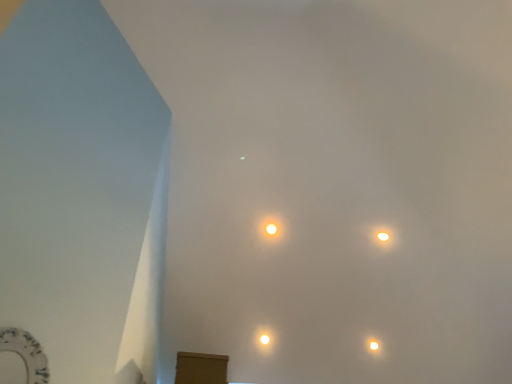
How much space does white glossy lamp at center, positioned as the third lamp in right-to-left order, occupy horizontally?

1.65 inches.

This screenshot has width=512, height=384. Find the location of `white glossy lamp at center, positioned as the third lamp in right-to-left order`. white glossy lamp at center, positioned as the third lamp in right-to-left order is located at coordinates (264, 339).

Is white glossy lamp at upper right, which appears as the second lamp when viewed from the top, turned away from white glossy lamp at center, positioned as the third lamp in right-to-left order?

No, white glossy lamp at upper right, which appears as the second lamp when viewed from the top,'s orientation is not away from white glossy lamp at center, positioned as the third lamp in right-to-left order.

Considering the sizes of objects white glossy lamp at upper right, which appears as the second lamp when viewed from the top, and white glossy lamp at center, which is counted as the 1th lamp, starting from the left, in the image provided, who is shorter, white glossy lamp at upper right, which appears as the second lamp when viewed from the top, or white glossy lamp at center, which is counted as the 1th lamp, starting from the left,?

With less height is white glossy lamp at center, which is counted as the 1th lamp, starting from the left.

Considering the relative sizes of white glossy lamp at upper right, which is counted as the 3th lamp, starting from the left, and white glossy lamp at center, positioned as the third lamp in right-to-left order, in the image provided, is white glossy lamp at upper right, which is counted as the 3th lamp, starting from the left, wider than white glossy lamp at center, positioned as the third lamp in right-to-left order,?

No.

Between white glossy lamp at upper right, the second lamp positioned from the bottom, and white glossy lamp at center, positioned as the third lamp in right-to-left order, which one has smaller size?

white glossy lamp at center, positioned as the third lamp in right-to-left order, is smaller.

Which point is more distant from viewer, (273, 227) or (384, 235)?

Point (384, 235)

Is matte yellow light at center, which is the 3th lamp from bottom to top, shorter than white glossy lamp at upper right, which is counted as the 3th lamp, starting from the left?

Yes, matte yellow light at center, which is the 3th lamp from bottom to top, is shorter than white glossy lamp at upper right, which is counted as the 3th lamp, starting from the left.

Does matte yellow light at center, which ranks as the 2th lamp in left-to-right order, have a greater width compared to white glossy lamp at upper right, the second lamp positioned from the bottom?

Answer: Yes.

Considering the positions of point (269, 338) and point (380, 237), is point (269, 338) closer or farther from the camera than point (380, 237)?

Point (269, 338) is farther from the camera than point (380, 237).

From the image's perspective, which object appears higher, white glossy lamp at center, positioned as the third lamp in right-to-left order, or white glossy lamp at upper right, the first lamp viewed from the right?

white glossy lamp at upper right, the first lamp viewed from the right, is shown above in the image.

Choose the correct answer: Is white glossy lamp at center, which is counted as the 1th lamp, starting from the left, inside white glossy lamp at upper right, the second lamp positioned from the bottom, or outside it?

white glossy lamp at center, which is counted as the 1th lamp, starting from the left, is not inside white glossy lamp at upper right, the second lamp positioned from the bottom, it's outside.

Is matte yellow light at center, which ranks as the 2th lamp in left-to-right order, at the left side of white glossy lamp at center, which is counted as the 1th lamp, starting from the left?

No, matte yellow light at center, which ranks as the 2th lamp in left-to-right order, is not to the left of white glossy lamp at center, which is counted as the 1th lamp, starting from the left.

I want to click on the 1st lamp to the right of the white glossy lamp at center, the first lamp ordered from the bottom, starting your count from the anchor, so click(271, 229).

From the picture: From a real-world perspective, is matte yellow light at center, marked as the 2th lamp in a right-to-left arrangement, below white glossy lamp at center, positioned as the third lamp in right-to-left order?

No.

Is matte yellow light at center, marked as the 2th lamp in a right-to-left arrangement, with white glossy lamp at center, which is counted as the 1th lamp, starting from the left?

No, matte yellow light at center, marked as the 2th lamp in a right-to-left arrangement, is not in contact with white glossy lamp at center, which is counted as the 1th lamp, starting from the left.

Is white glossy lamp at upper right, the first lamp viewed from the right, positioned with its back to matte yellow light at center, which is the first lamp in top-to-bottom order?

No.

Does white glossy lamp at upper right, which is counted as the 3th lamp, starting from the left, have a greater width compared to matte yellow light at center, which is the first lamp in top-to-bottom order?

No.

Is white glossy lamp at upper right, the second lamp positioned from the bottom, positioned beyond the bounds of matte yellow light at center, marked as the 2th lamp in a right-to-left arrangement?

Yes, white glossy lamp at upper right, the second lamp positioned from the bottom, is not within matte yellow light at center, marked as the 2th lamp in a right-to-left arrangement.

Who is smaller, white glossy lamp at upper right, the second lamp positioned from the bottom, or matte yellow light at center, which is the first lamp in top-to-bottom order?

With smaller size is white glossy lamp at upper right, the second lamp positioned from the bottom.

Considering the positions of objects white glossy lamp at center, which is counted as the 1th lamp, starting from the left, and matte yellow light at center, which is the 3th lamp from bottom to top, in the image provided, who is more to the left, white glossy lamp at center, which is counted as the 1th lamp, starting from the left, or matte yellow light at center, which is the 3th lamp from bottom to top,?

Positioned to the left is white glossy lamp at center, which is counted as the 1th lamp, starting from the left.

Is the position of white glossy lamp at center, positioned as the third lamp in right-to-left order, less distant than that of matte yellow light at center, which ranks as the 2th lamp in left-to-right order?

No, the depth of white glossy lamp at center, positioned as the third lamp in right-to-left order, is greater than that of matte yellow light at center, which ranks as the 2th lamp in left-to-right order.

Which of these two, white glossy lamp at center, which is counted as the 1th lamp, starting from the left, or matte yellow light at center, marked as the 2th lamp in a right-to-left arrangement, is wider?

white glossy lamp at center, which is counted as the 1th lamp, starting from the left, is wider.

Is white glossy lamp at center, which is counted as the 1th lamp, starting from the left, oriented away from matte yellow light at center, which is the first lamp in top-to-bottom order?

That's not correct — white glossy lamp at center, which is counted as the 1th lamp, starting from the left, is not looking away from matte yellow light at center, which is the first lamp in top-to-bottom order.

Where is `lamp that is the 2nd object to the left of the white glossy lamp at upper right, the first lamp viewed from the right, starting at the anchor`? lamp that is the 2nd object to the left of the white glossy lamp at upper right, the first lamp viewed from the right, starting at the anchor is located at coordinates pos(264,339).

Where is `lamp that is on the right side of matte yellow light at center, which ranks as the 2th lamp in left-to-right order`? This screenshot has width=512, height=384. lamp that is on the right side of matte yellow light at center, which ranks as the 2th lamp in left-to-right order is located at coordinates (383, 236).

Estimate the real-world distances between objects in this image. Which object is closer to white glossy lamp at upper right, which is counted as the 3th lamp, starting from the left, white glossy lamp at center, which is counted as the 1th lamp, starting from the left, or matte yellow light at center, marked as the 2th lamp in a right-to-left arrangement?

Based on the image, matte yellow light at center, marked as the 2th lamp in a right-to-left arrangement, appears to be nearer to white glossy lamp at upper right, which is counted as the 3th lamp, starting from the left.

Which object lies nearer to the anchor point matte yellow light at center, marked as the 2th lamp in a right-to-left arrangement, white glossy lamp at upper right, which appears as the second lamp when viewed from the top, or white glossy lamp at center, positioned as the third lamp in right-to-left order?

white glossy lamp at upper right, which appears as the second lamp when viewed from the top, is closer to matte yellow light at center, marked as the 2th lamp in a right-to-left arrangement.

From the image, which object appears to be farther from white glossy lamp at center, which is counted as the 1th lamp, starting from the left, white glossy lamp at upper right, the first lamp viewed from the right, or matte yellow light at center, which ranks as the 2th lamp in left-to-right order?

Based on the image, white glossy lamp at upper right, the first lamp viewed from the right, appears to be further to white glossy lamp at center, which is counted as the 1th lamp, starting from the left.

From the image, which object appears to be nearer to white glossy lamp at upper right, which appears as the second lamp when viewed from the top, matte yellow light at center, which ranks as the 2th lamp in left-to-right order, or white glossy lamp at center, the 3th lamp positioned from the top?

matte yellow light at center, which ranks as the 2th lamp in left-to-right order, is closer to white glossy lamp at upper right, which appears as the second lamp when viewed from the top.

Looking at this image, estimate the real-world distances between objects in this image. Which object is closer to matte yellow light at center, which ranks as the 2th lamp in left-to-right order, white glossy lamp at center, the 3th lamp positioned from the top, or white glossy lamp at upper right, which is counted as the 3th lamp, starting from the left?

white glossy lamp at upper right, which is counted as the 3th lamp, starting from the left, lies closer to matte yellow light at center, which ranks as the 2th lamp in left-to-right order, than the other object.

Estimate the real-world distances between objects in this image. Which object is further from white glossy lamp at center, the first lamp ordered from the bottom, matte yellow light at center, marked as the 2th lamp in a right-to-left arrangement, or white glossy lamp at upper right, the first lamp viewed from the right?

The object further to white glossy lamp at center, the first lamp ordered from the bottom, is white glossy lamp at upper right, the first lamp viewed from the right.

Find the location of a particular element. This screenshot has width=512, height=384. lamp situated between white glossy lamp at center, positioned as the third lamp in right-to-left order, and white glossy lamp at upper right, the second lamp positioned from the bottom, from left to right is located at coordinates (271, 229).